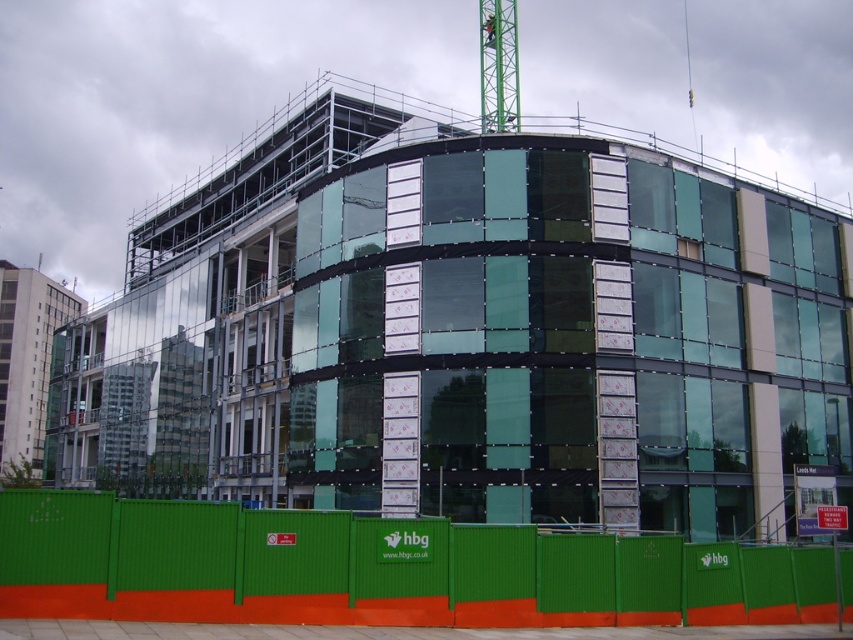
You are a construction worker needing to move a heavy beam from the green glass building at center to the green metallic crane at upper center. The beam is 80 feet long. Can you safely transport it horizontally without bending or breaking the beam?

The distance between the green glass building at center and the green metallic crane at upper center is 90.27 feet. Since the beam is only 80 feet long, it can be safely transported horizontally as it is shorter than the required distance.

You are standing in front of the construction site and want to determine the relative positions of two points marked on the temporary fence. The points are labeled as point (100, 368) and point (494, 124). Which point is closer to you?

Point (100, 368) is further to the viewer than point (494, 124), so the closer point to you is point (494, 124).

You are a construction worker who needs to move a heavy beam from the green corrugated plastic at lower center to the green metallic crane at upper center. Which direction should you move the beam to reach the crane?

The green corrugated plastic at lower center is to the left of the green metallic crane at upper center, so you should move the beam to the right to reach the crane.